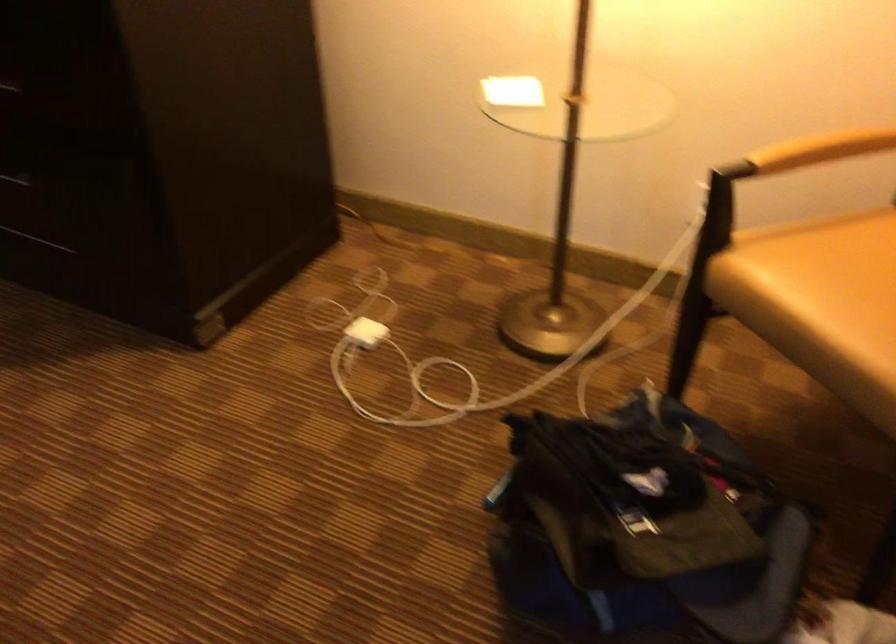
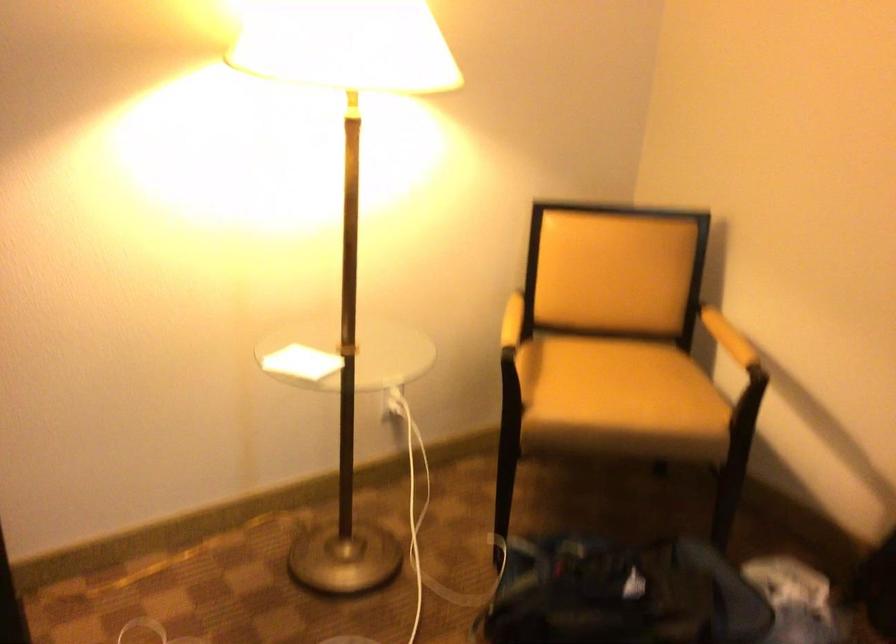
In the second image, find the point that corresponds to the point at 793,142 in the first image.

(512, 321)